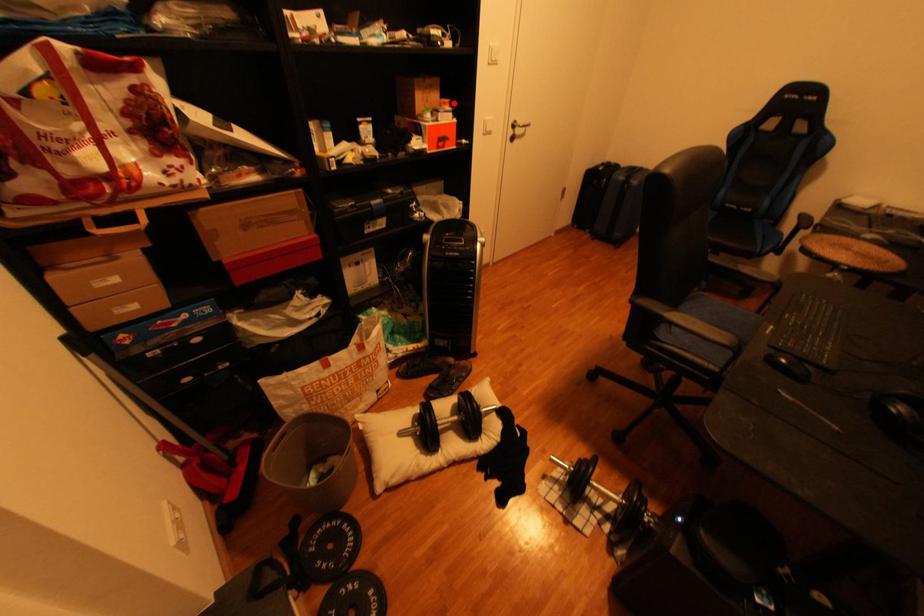
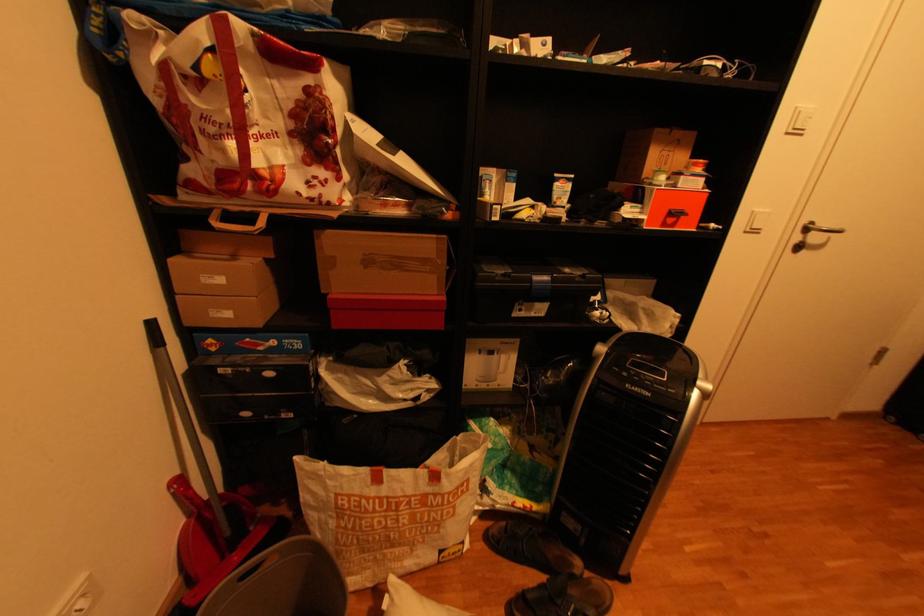
In the second image, find the point that corresponds to the highlighted location in the first image.

(704, 166)